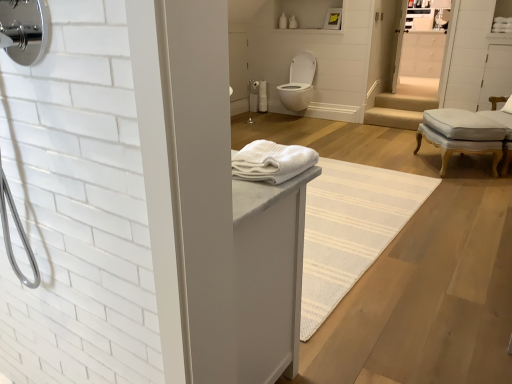
You are a GUI agent. You are given a task and a screenshot of the screen. Output one action in this format:
    pyautogui.click(x=<x>, y=<y>)
    Task: Click on the space that is in front of light gray fabric ottoman at right
    This screenshot has height=384, width=512.
    Given the screenshot: What is the action you would take?
    pyautogui.click(x=459, y=184)